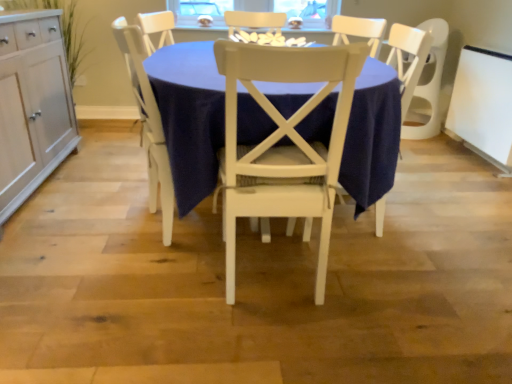
Describe the element at coordinates (149, 110) in the screenshot. I see `white wood chair at center, which ranks as the second chair in right-to-left order` at that location.

This screenshot has height=384, width=512. Find the location of `white wood cabinet at left`. white wood cabinet at left is located at coordinates (32, 104).

This screenshot has width=512, height=384. Describe the element at coordinates (412, 60) in the screenshot. I see `white wood chair at center` at that location.

The width and height of the screenshot is (512, 384). Find the location of `white glossy cookies at center`. white glossy cookies at center is located at coordinates (268, 39).

Locate an element on the screen. The height and width of the screenshot is (384, 512). white painted wood chair at center, placed as the 2th chair when sorted from left to right is located at coordinates (284, 146).

From a real-world perspective, is white wood chair at center, which ranks as the second chair in right-to-left order, physically above white wood chair at center?

No, from a real-world perspective, white wood chair at center, which ranks as the second chair in right-to-left order, is not above white wood chair at center.

From their relative heights in the image, would you say white wood chair at center, which ranks as the second chair in right-to-left order, is taller or shorter than white wood chair at center?

white wood chair at center, which ranks as the second chair in right-to-left order, is taller than white wood chair at center.

Is white wood chair at center, which ranks as the second chair in right-to-left order, smaller than white wood chair at center?

Yes, white wood chair at center, which ranks as the second chair in right-to-left order, is smaller than white wood chair at center.

Which of these two, white wood chair at center, which ranks as the second chair in right-to-left order, or white wood chair at center, is wider?

white wood chair at center is wider.

Could you tell me if white wood cabinet at left is turned towards white wood chair at center, the first chair in the left-to-right sequence?

Yes, white wood cabinet at left is aimed at white wood chair at center, the first chair in the left-to-right sequence.

From a real-world perspective, is white wood cabinet at left on top of white wood chair at center, the first chair in the left-to-right sequence?

Yes, from a real-world perspective, white wood cabinet at left is over white wood chair at center, the first chair in the left-to-right sequence

Would you say white wood cabinet at left is to the left or to the right of white wood chair at center, which ranks as the second chair in right-to-left order, in the picture?

Clearly, white wood cabinet at left is on the left of white wood chair at center, which ranks as the second chair in right-to-left order, in the image.

Does white wood cabinet at left have a smaller size compared to white wood chair at center, the first chair in the left-to-right sequence?

No, white wood cabinet at left is not smaller than white wood chair at center, the first chair in the left-to-right sequence.

Considering the relative positions of white wood chair at center and white wood chair at center, which ranks as the second chair in right-to-left order, in the image provided, is white wood chair at center to the right of white wood chair at center, which ranks as the second chair in right-to-left order, from the viewer's perspective?

Yes, white wood chair at center is to the right of white wood chair at center, which ranks as the second chair in right-to-left order.

Consider the image. Is white wood chair at center wider than white wood chair at center, which ranks as the second chair in right-to-left order?

Indeed, white wood chair at center has a greater width compared to white wood chair at center, which ranks as the second chair in right-to-left order.

Between white wood chair at center and white wood chair at center, which ranks as the second chair in right-to-left order, which one has larger size?

white wood chair at center is bigger.

Considering the sizes of white wood chair at center and white wood chair at center, the first chair in the left-to-right sequence, in the image, is white wood chair at center taller or shorter than white wood chair at center, the first chair in the left-to-right sequence,?

Clearly, white wood chair at center is shorter compared to white wood chair at center, the first chair in the left-to-right sequence.

From the picture: Can you confirm if white glossy cookies at center is taller than white painted wood chair at center, arranged as the 1th chair when viewed from the right?

No, white glossy cookies at center is not taller than white painted wood chair at center, arranged as the 1th chair when viewed from the right.

From the picture: Is white glossy cookies at center surrounding white painted wood chair at center, arranged as the 1th chair when viewed from the right?

No, white painted wood chair at center, arranged as the 1th chair when viewed from the right, is not inside white glossy cookies at center.

How different are the orientations of white glossy cookies at center and white painted wood chair at center, placed as the 2th chair when sorted from left to right, in degrees?

white glossy cookies at center and white painted wood chair at center, placed as the 2th chair when sorted from left to right, are facing 175 degrees away from each other.

Is point (283, 45) closer or farther from the camera than point (404, 39)?

Point (283, 45).

Between white glossy cookies at center and white wood chair at center, which one has less height?

With less height is white glossy cookies at center.

Considering the sizes of objects white glossy cookies at center and white wood chair at center in the image provided, who is bigger, white glossy cookies at center or white wood chair at center?

white wood chair at center.

Considering the sizes of white glossy cookies at center and white wood chair at center in the image, is white glossy cookies at center wider or thinner than white wood chair at center?

Clearly, white glossy cookies at center has less width compared to white wood chair at center.

Is white wood cabinet at left situated inside white painted wood chair at center, placed as the 2th chair when sorted from left to right, or outside?

white wood cabinet at left is spatially situated outside white painted wood chair at center, placed as the 2th chair when sorted from left to right.

Is white wood cabinet at left shorter than white painted wood chair at center, placed as the 2th chair when sorted from left to right?

Yes.

Considering the relative sizes of white wood cabinet at left and white painted wood chair at center, placed as the 2th chair when sorted from left to right, in the image provided, is white wood cabinet at left smaller than white painted wood chair at center, placed as the 2th chair when sorted from left to right,?

Incorrect, white wood cabinet at left is not smaller in size than white painted wood chair at center, placed as the 2th chair when sorted from left to right.

Can you confirm if white painted wood chair at center, arranged as the 1th chair when viewed from the right, is shorter than white wood chair at center, the first chair in the left-to-right sequence?

Yes.

Does white painted wood chair at center, placed as the 2th chair when sorted from left to right, have a smaller size compared to white wood chair at center, the first chair in the left-to-right sequence?

Incorrect, white painted wood chair at center, placed as the 2th chair when sorted from left to right, is not smaller in size than white wood chair at center, the first chair in the left-to-right sequence.

Does point (292, 190) come behind point (161, 38)?

No, (292, 190) is in front of (161, 38).

Is white painted wood chair at center, placed as the 2th chair when sorted from left to right, turned away from white wood chair at center, the first chair in the left-to-right sequence?

No, white wood chair at center, the first chair in the left-to-right sequence, is not at the back of white painted wood chair at center, placed as the 2th chair when sorted from left to right.

Locate an element on the screen. Image resolution: width=512 pixels, height=384 pixels. armchair on the right of white wood chair at center, which ranks as the second chair in right-to-left order is located at coordinates (412, 60).

What are the coordinates of `chair behind the white wood cabinet at left` in the screenshot? It's located at (149, 110).

When comparing their distances from white wood chair at center, the first chair in the left-to-right sequence, does white painted wood chair at center, placed as the 2th chair when sorted from left to right, or white glossy cookies at center seem further?

The object further to white wood chair at center, the first chair in the left-to-right sequence, is white glossy cookies at center.

When comparing their distances from white wood chair at center, does white wood cabinet at left or white glossy cookies at center seem further?

Among the two, white wood cabinet at left is located further to white wood chair at center.

Considering their positions, is white wood chair at center positioned closer to white wood chair at center, which ranks as the second chair in right-to-left order, than white wood cabinet at left?

white wood cabinet at left lies closer to white wood chair at center, which ranks as the second chair in right-to-left order, than the other object.

From the picture: Looking at the image, which one is located closer to white glossy cookies at center, white wood chair at center or white wood cabinet at left?

white wood chair at center is positioned closer to the anchor white glossy cookies at center.

Which object lies further to the anchor point white wood chair at center, which ranks as the second chair in right-to-left order, white glossy cookies at center or white wood cabinet at left?

Among the two, white glossy cookies at center is located further to white wood chair at center, which ranks as the second chair in right-to-left order.

Estimate the real-world distances between objects in this image. Which object is further from white glossy cookies at center, white wood chair at center, which ranks as the second chair in right-to-left order, or white wood cabinet at left?

white wood cabinet at left.

Based on their spatial positions, is white painted wood chair at center, arranged as the 1th chair when viewed from the right, or white wood chair at center further from white wood cabinet at left?

Based on the image, white wood chair at center appears to be further to white wood cabinet at left.

When comparing their distances from white wood chair at center, does white glossy cookies at center or white painted wood chair at center, placed as the 2th chair when sorted from left to right, seem closer?

white glossy cookies at center.

I want to click on food located between white wood cabinet at left and white wood chair at center in the left-right direction, so click(268, 39).

Image resolution: width=512 pixels, height=384 pixels. Identify the location of chair located between white wood cabinet at left and white painted wood chair at center, arranged as the 1th chair when viewed from the right, in the left-right direction. (149, 110).

Locate an element on the screen. Image resolution: width=512 pixels, height=384 pixels. food between white wood chair at center, which ranks as the second chair in right-to-left order, and white wood chair at center, in the horizontal direction is located at coordinates (268, 39).

I want to click on armchair between white painted wood chair at center, placed as the 2th chair when sorted from left to right, and white glossy cookies at center from front to back, so click(x=412, y=60).